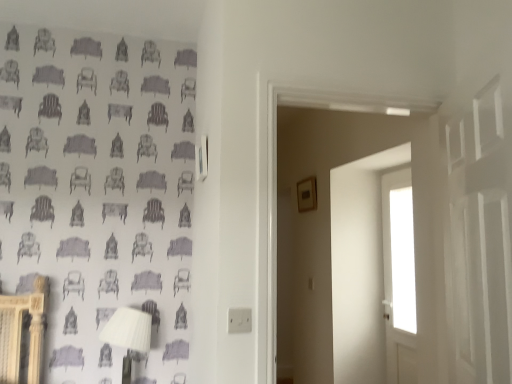
Question: Is transparent glass window at upper right, which is counted as the 2th window, starting from the bottom, located outside transparent glass door at center, the second window from the top?

Choices:
 (A) yes
 (B) no

Answer: (B)

Question: From the image's perspective, would you say transparent glass window at upper right, which is counted as the first window, starting from the top, is shown under transparent glass door at center, placed as the first window when sorted from bottom to top?

Choices:
 (A) no
 (B) yes

Answer: (A)

Question: Is transparent glass window at upper right, which is counted as the first window, starting from the top, not near transparent glass door at center, placed as the first window when sorted from bottom to top?

Choices:
 (A) yes
 (B) no

Answer: (B)

Question: Does transparent glass window at upper right, which is counted as the 2th window, starting from the bottom, have a larger size compared to transparent glass door at center, the second window from the top?

Choices:
 (A) no
 (B) yes

Answer: (A)

Question: From a real-world perspective, is transparent glass window at upper right, which is counted as the first window, starting from the top, under transparent glass door at center, the second window from the top?

Choices:
 (A) no
 (B) yes

Answer: (A)

Question: Is transparent glass window at upper right, which is counted as the first window, starting from the top, thinner than transparent glass door at center, placed as the first window when sorted from bottom to top?

Choices:
 (A) no
 (B) yes

Answer: (B)

Question: Can you confirm if transparent glass door at center, the second window from the top, is shorter than white plastic table lamp at lower left?

Choices:
 (A) yes
 (B) no

Answer: (B)

Question: Is transparent glass door at center, placed as the first window when sorted from bottom to top, at the left side of white plastic table lamp at lower left?

Choices:
 (A) no
 (B) yes

Answer: (A)

Question: Is transparent glass door at center, the second window from the top, thinner than white plastic table lamp at lower left?

Choices:
 (A) yes
 (B) no

Answer: (A)

Question: From a real-world perspective, is transparent glass door at center, placed as the first window when sorted from bottom to top, on top of white plastic table lamp at lower left?

Choices:
 (A) yes
 (B) no

Answer: (A)

Question: Could you tell me if transparent glass door at center, the second window from the top, is facing white plastic table lamp at lower left?

Choices:
 (A) no
 (B) yes

Answer: (B)

Question: Is transparent glass door at center, placed as the first window when sorted from bottom to top, to the right of white plastic table lamp at lower left from the viewer's perspective?

Choices:
 (A) yes
 (B) no

Answer: (A)

Question: Is white plastic table lamp at lower left at the right side of transparent glass window at upper right, which is counted as the 2th window, starting from the bottom?

Choices:
 (A) no
 (B) yes

Answer: (A)